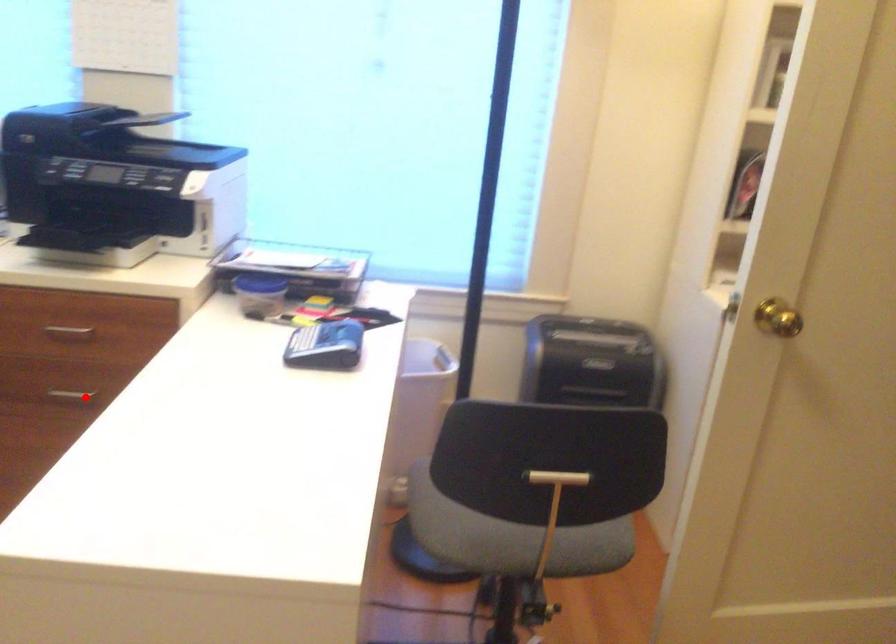
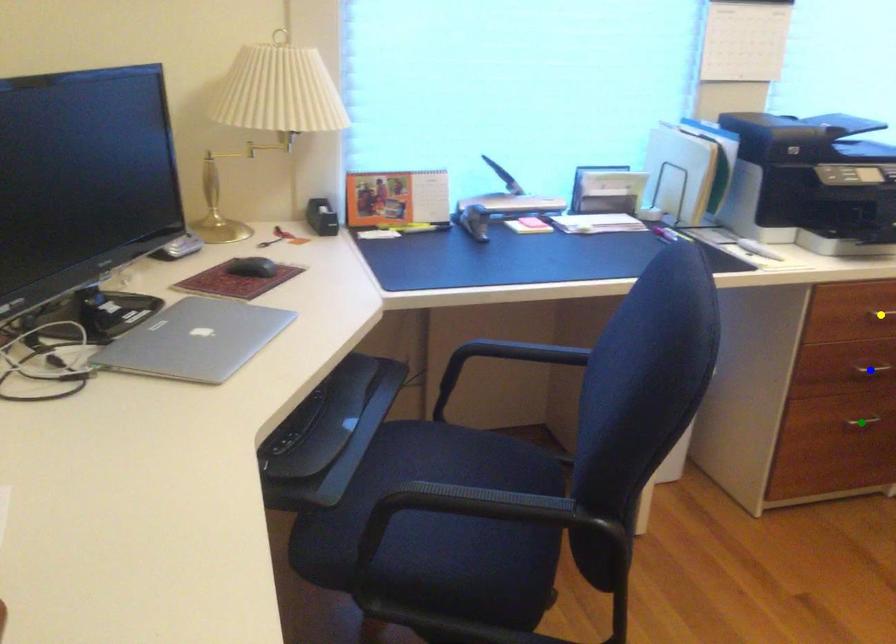
Question: I am providing you with two images of the same scene from different viewpoints. A red point is marked on the first image. You are given multiple points on the second image. Which point in image 2 represents the same 3d spot as the red point in image 1?

Choices:
 (A) green point
 (B) blue point
 (C) yellow point

Answer: (B)